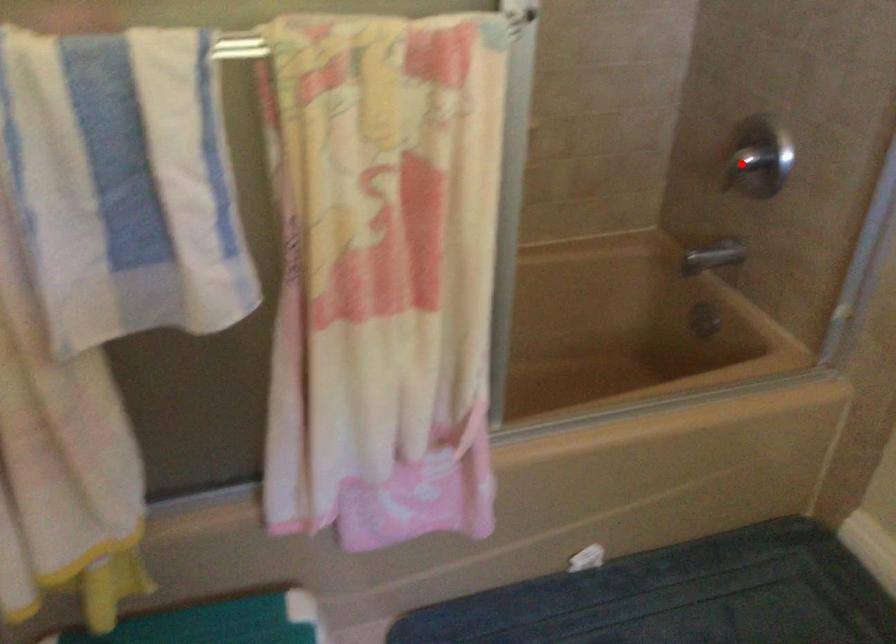
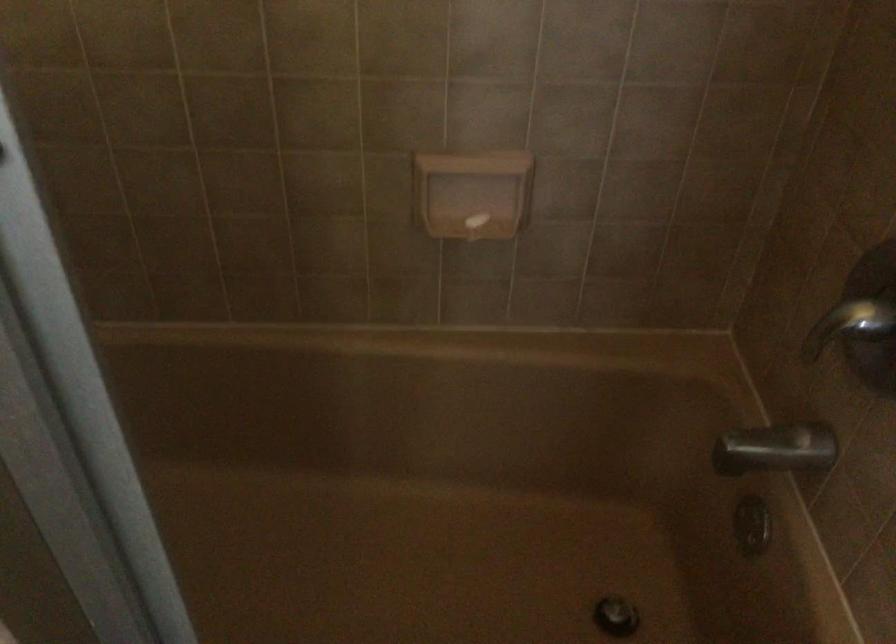
Question: I am providing you with two images of the same scene from different viewpoints. A red point is shown in image1. For the corresponding object point in image2, is it positioned nearer or farther from the camera?

Choices:
 (A) Nearer
 (B) Farther

Answer: (A)